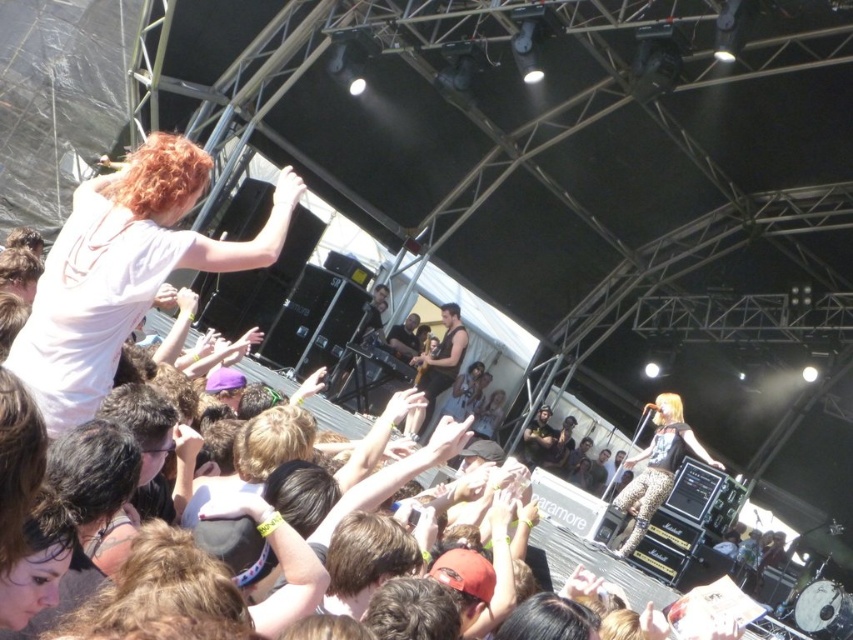
Question: Among these points, which one is farthest from the camera?

Choices:
 (A) (86, 413)
 (B) (404, 337)
 (C) (656, 474)

Answer: (B)

Question: Does matte white t-shirt at upper left appear on the right side of matte black guitar at center?

Choices:
 (A) no
 (B) yes

Answer: (A)

Question: Which of these objects is positioned farthest from the matte black guitar at center?

Choices:
 (A) leopard print pants at center
 (B) matte white t-shirt at upper left

Answer: (B)

Question: Where is matte white t-shirt at upper left located in relation to leopard print pants at center in the image?

Choices:
 (A) left
 (B) right

Answer: (A)

Question: Estimate the real-world distances between objects in this image. Which object is farther from the leopard print pants at center?

Choices:
 (A) matte black guitar at center
 (B) matte white t-shirt at upper left

Answer: (B)

Question: Is leopard print pants at center positioned behind matte black guitar at center?

Choices:
 (A) yes
 (B) no

Answer: (B)